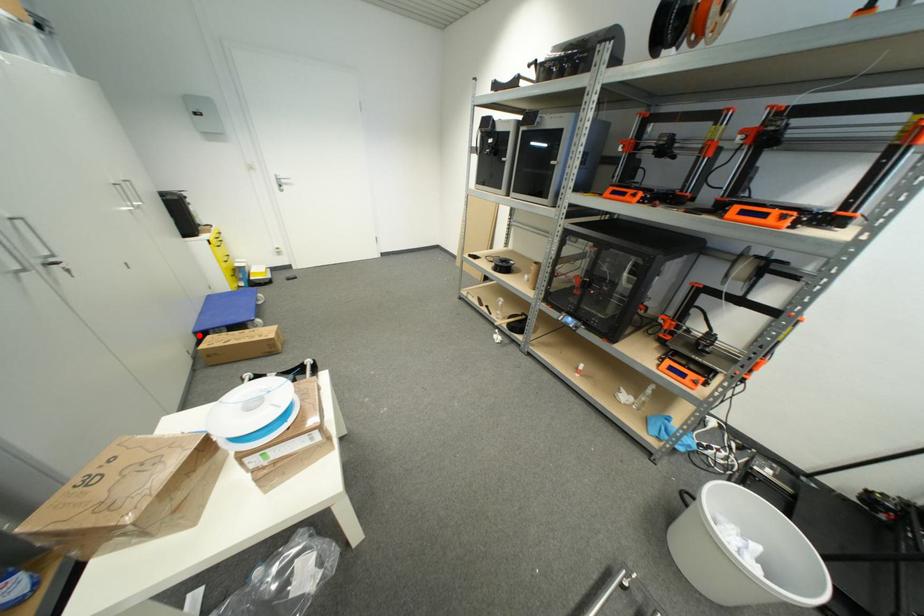
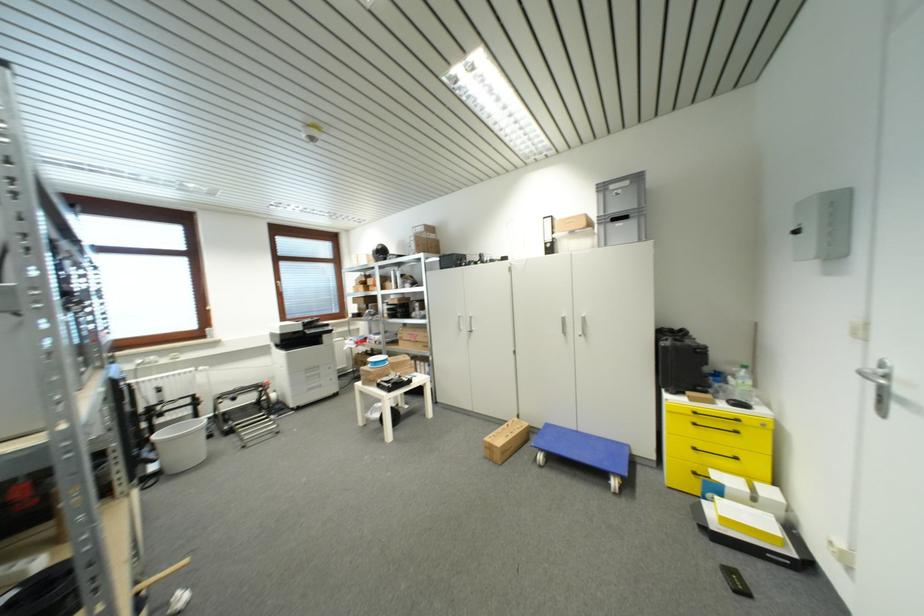
Question: I am providing you with two images of the same scene from different viewpoints. Given a red point in image1, look at the same physical point in image2. Is it:

Choices:
 (A) Closer to the viewpoint
 (B) Farther from the viewpoint

Answer: (B)